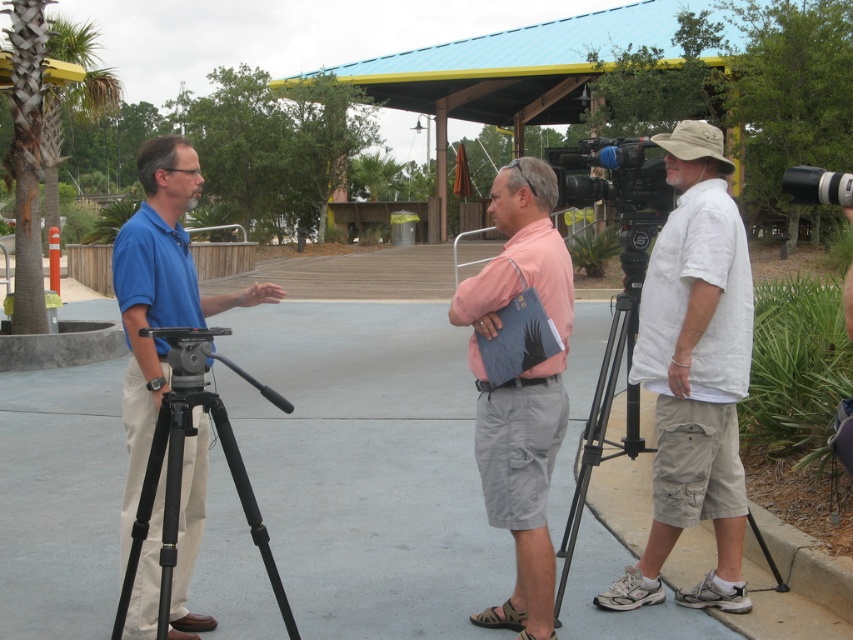
Question: Which point is closer to the camera taking this photo?

Choices:
 (A) (492, 180)
 (B) (840, 204)
 (C) (640, 264)
 (D) (604, 156)

Answer: (B)

Question: Is black matte tripod at left smaller than black plastic camera at upper right?

Choices:
 (A) yes
 (B) no

Answer: (B)

Question: Which of the following is the farthest from the observer?

Choices:
 (A) (589, 141)
 (B) (289, 621)
 (C) (587, 483)
 (D) (498, 291)

Answer: (A)

Question: Which object appears closest to the camera in this image?

Choices:
 (A) black metal tripod at right
 (B) black plastic video camera at center
 (C) pink cotton shirt at center

Answer: (C)

Question: Where is pink cotton shirt at center located in relation to black plastic camera at upper right in the image?

Choices:
 (A) right
 (B) left

Answer: (B)

Question: Considering the relative positions of black metal tripod at right and black plastic camera at upper right in the image provided, where is black metal tripod at right located with respect to black plastic camera at upper right?

Choices:
 (A) above
 (B) below

Answer: (B)